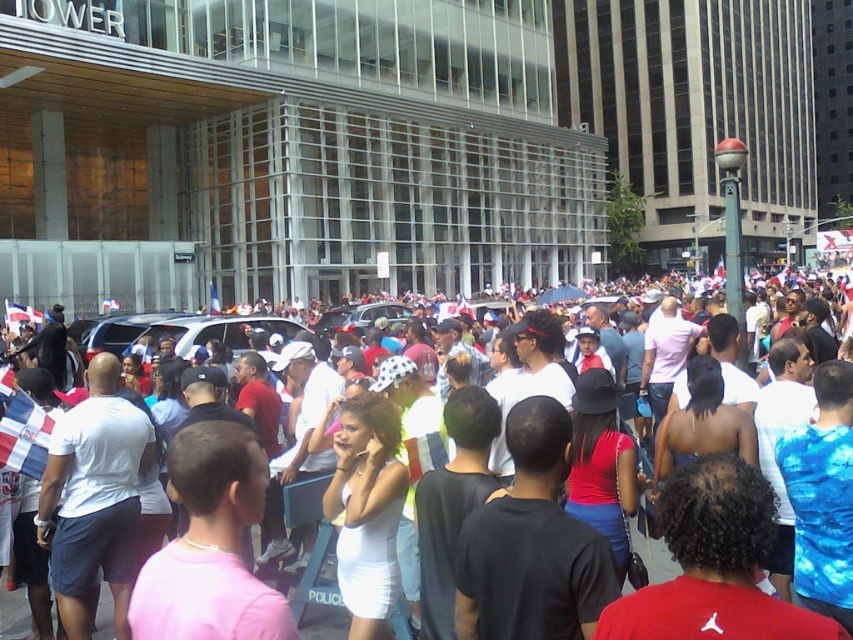
You are a photographer standing in the urban scene and want to take a photo of both the white cotton crowd at center and the silver metallic suv at center. Which object should you focus on first to ensure both are in sharp focus?

You should focus on the white cotton crowd at center first because it is closer to the viewer than the silver metallic suv at center, so by focusing on the closer object, the SUV will be within the depth of field and also in focus.

You are a photographer trying to capture the crowd in the center of the image. According to the coordinates provided, where exactly is the white cotton crowd at center located?

The white cotton crowd at center is located at coordinates point (323,620).

You are a delivery driver who needs to navigate through the urban scene shown. You see a white cotton crowd at center and a silver metallic suv at center. Which object is positioned to the right of the other?

The white cotton crowd at center is positioned to the right of the silver metallic suv at center.